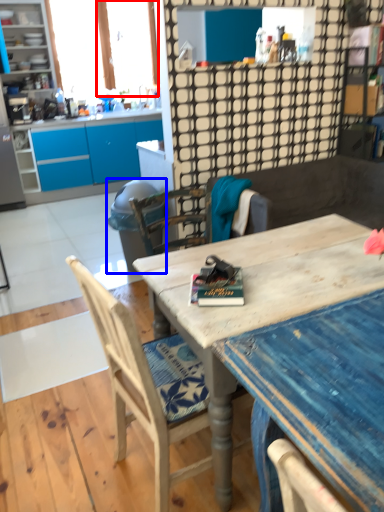
Question: Which object appears farthest to the camera in this image, window screen (highlighted by a red box) or trash bin/can (highlighted by a blue box)?

Choices:
 (A) window screen
 (B) trash bin/can

Answer: (A)